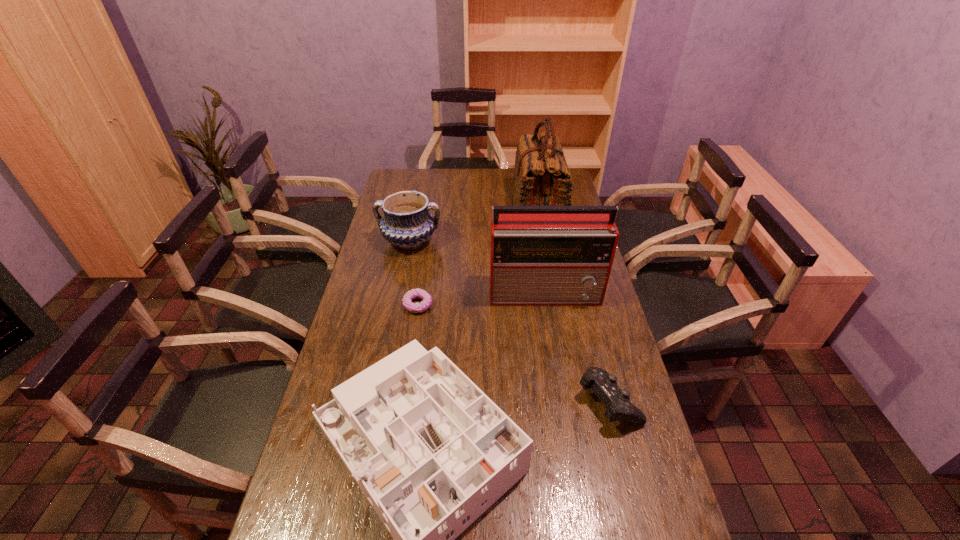
I want to click on object that ranks as the third closest to the radio receiver, so click(407, 223).

You are a GUI agent. You are given a task and a screenshot of the screen. Output one action in this format:
    pyautogui.click(x=<x>, y=<y>)
    Task: Click on the object that stands as the closest to the shopping bag
    The width and height of the screenshot is (960, 540).
    Given the screenshot: What is the action you would take?
    pyautogui.click(x=407, y=223)

Locate an element on the screen. vacant area that satisfies the following two spatial constraints: 1. on the back side of the fifth tallest object; 2. on the open handle side of the shopping bag is located at coordinates (560, 208).

Where is `free space that satisfies the following two spatial constraints: 1. on the front side of the fifth tallest object; 2. on the right side of the shortest object`? The width and height of the screenshot is (960, 540). free space that satisfies the following two spatial constraints: 1. on the front side of the fifth tallest object; 2. on the right side of the shortest object is located at coordinates (403, 401).

Where is `free region that satisfies the following two spatial constraints: 1. on the open handle side of the second shortest object; 2. on the right side of the shopping bag`? This screenshot has height=540, width=960. free region that satisfies the following two spatial constraints: 1. on the open handle side of the second shortest object; 2. on the right side of the shopping bag is located at coordinates (575, 401).

Locate an element on the screen. free space that satisfies the following two spatial constraints: 1. on the open handle side of the shopping bag; 2. on the front-facing side of the radio receiver is located at coordinates 555,293.

Identify the location of free point that satisfies the following two spatial constraints: 1. on the front-facing side of the radio receiver; 2. on the right side of the control. (565, 401).